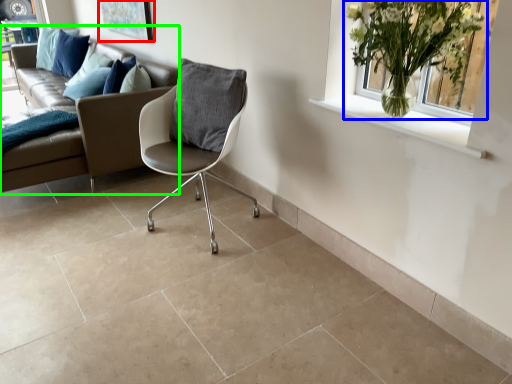
Question: Based on their relative distances, which object is nearer to picture frame (highlighted by a red box)? Choose from houseplant (highlighted by a blue box) and studio couch (highlighted by a green box).

Choices:
 (A) houseplant
 (B) studio couch

Answer: (B)